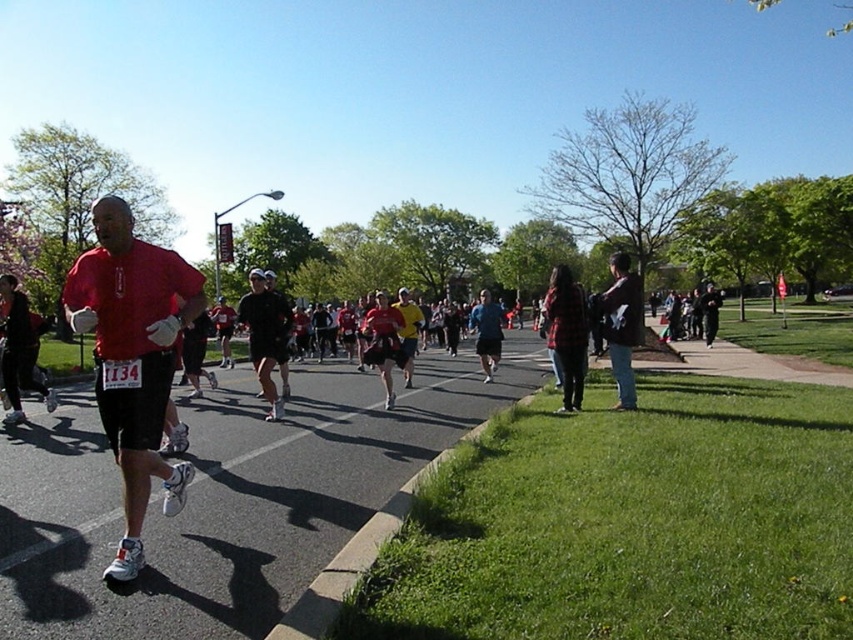
Question: Can you confirm if brown leather jacket at right is smaller than yellow fabric shirt at center?

Choices:
 (A) yes
 (B) no

Answer: (B)

Question: Estimate the real-world distances between objects in this image. Which object is closer to the yellow fabric shirt at center?

Choices:
 (A) black matte shorts at center
 (B) brown leather jacket at right

Answer: (A)

Question: From the image, what is the correct spatial relationship of brown leather jacket at right in relation to yellow fabric shirt at center?

Choices:
 (A) right
 (B) left

Answer: (A)

Question: Can you confirm if brown leather jacket at right is positioned below yellow fabric shirt at center?

Choices:
 (A) yes
 (B) no

Answer: (B)

Question: Which point is farther to the camera?

Choices:
 (A) (624, 262)
 (B) (132, 538)
 (C) (410, 358)

Answer: (C)

Question: Which point is farther to the camera?

Choices:
 (A) (618, 317)
 (B) (267, 330)
 (C) (68, 273)
 (D) (404, 314)

Answer: (D)